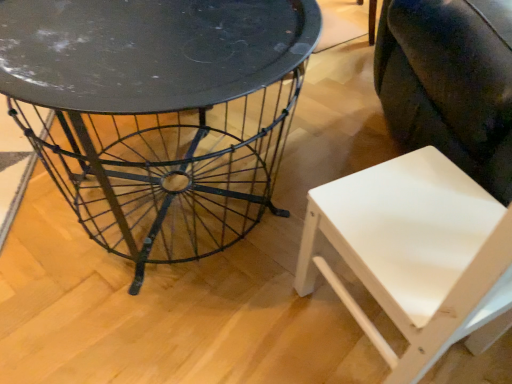
Question: Is metallic wire table at center not within white matte swivel chair at lower right?

Choices:
 (A) yes
 (B) no

Answer: (A)

Question: From the image's perspective, is metallic wire table at center on white matte swivel chair at lower right?

Choices:
 (A) no
 (B) yes

Answer: (A)

Question: From a real-world perspective, is metallic wire table at center positioned under white matte swivel chair at lower right based on gravity?

Choices:
 (A) yes
 (B) no

Answer: (A)

Question: From a real-world perspective, is metallic wire table at center located higher than white matte swivel chair at lower right?

Choices:
 (A) no
 (B) yes

Answer: (A)

Question: Can you confirm if metallic wire table at center is positioned to the right of white matte swivel chair at lower right?

Choices:
 (A) yes
 (B) no

Answer: (B)

Question: Can you confirm if metallic wire table at center is shorter than white matte swivel chair at lower right?

Choices:
 (A) yes
 (B) no

Answer: (A)

Question: Is white matte chair at lower right positioned with its back to white matte swivel chair at lower right?

Choices:
 (A) yes
 (B) no

Answer: (B)

Question: Is white matte chair at lower right placed right next to white matte swivel chair at lower right?

Choices:
 (A) no
 (B) yes

Answer: (A)

Question: Is white matte chair at lower right located outside white matte swivel chair at lower right?

Choices:
 (A) no
 (B) yes

Answer: (B)

Question: Considering the relative sizes of white matte chair at lower right and white matte swivel chair at lower right in the image provided, is white matte chair at lower right shorter than white matte swivel chair at lower right?

Choices:
 (A) yes
 (B) no

Answer: (A)

Question: Is white matte chair at lower right closer to the viewer compared to white matte swivel chair at lower right?

Choices:
 (A) yes
 (B) no

Answer: (A)

Question: Is white matte chair at lower right oriented towards white matte swivel chair at lower right?

Choices:
 (A) yes
 (B) no

Answer: (B)

Question: Is white matte chair at lower right positioned behind metallic wire table at center?

Choices:
 (A) no
 (B) yes

Answer: (A)